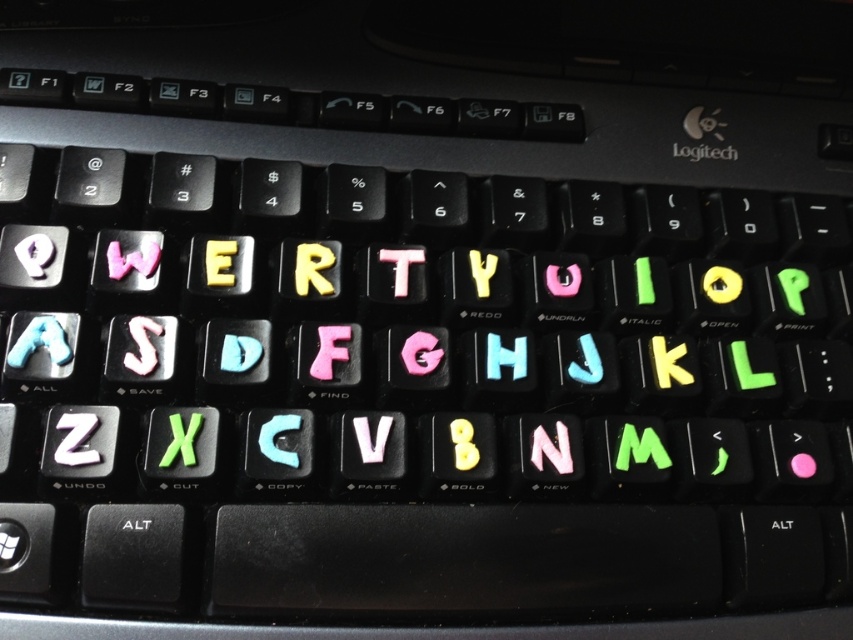
This screenshot has height=640, width=853. What do you see at coordinates (219, 262) in the screenshot?
I see `yellow matte letter e at center` at bounding box center [219, 262].

Consider the image. Does yellow matte letter e at center appear over green matte letter l at center?

Indeed, yellow matte letter e at center is positioned over green matte letter l at center.

Which is behind, point (227, 241) or point (757, 387)?

Point (757, 387)

Identify the location of yellow matte letter e at center. This screenshot has width=853, height=640. tap(219, 262).

Can you confirm if yellow matte letter r at center is positioned above white glossy letter s at center-left?

Yes.

Is point (300, 291) less distant than point (148, 349)?

No, (300, 291) is further to viewer.

Who is more distant from viewer, (331, 291) or (142, 355)?

The point (331, 291) is more distant.

You are a GUI agent. You are given a task and a screenshot of the screen. Output one action in this format:
    pyautogui.click(x=<x>, y=<y>)
    Task: Click on the yellow matte letter r at center
    The width and height of the screenshot is (853, 640).
    Given the screenshot: What is the action you would take?
    pyautogui.click(x=312, y=268)

Is yellow matte letter k at center wider than green matte letter p at center-right?

Yes.

Is yellow matte letter k at center smaller than green matte letter p at center-right?

Correct, yellow matte letter k at center occupies less space than green matte letter p at center-right.

Find the location of `yellow matte letter k at center`. yellow matte letter k at center is located at coordinates (668, 362).